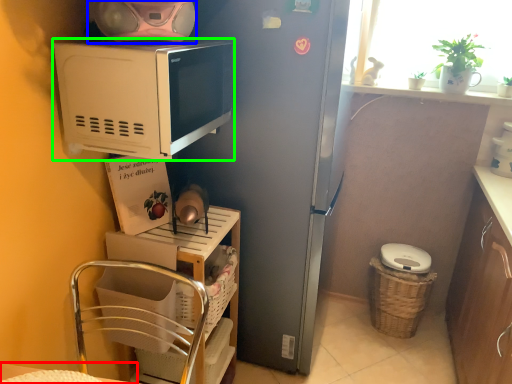
Question: Based on their relative distances, which object is farther from table (highlighted by a red box)? Choose from appliance (highlighted by a blue box) and microwave oven (highlighted by a green box).

Choices:
 (A) appliance
 (B) microwave oven

Answer: (A)